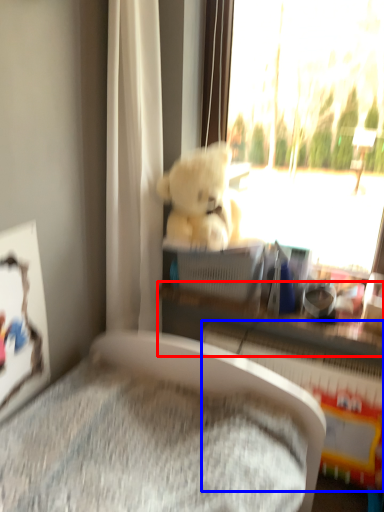
Question: Which object appears closest to the camera in this image, shelf (highlighted by a red box) or radiator (highlighted by a blue box)?

Choices:
 (A) shelf
 (B) radiator

Answer: (B)